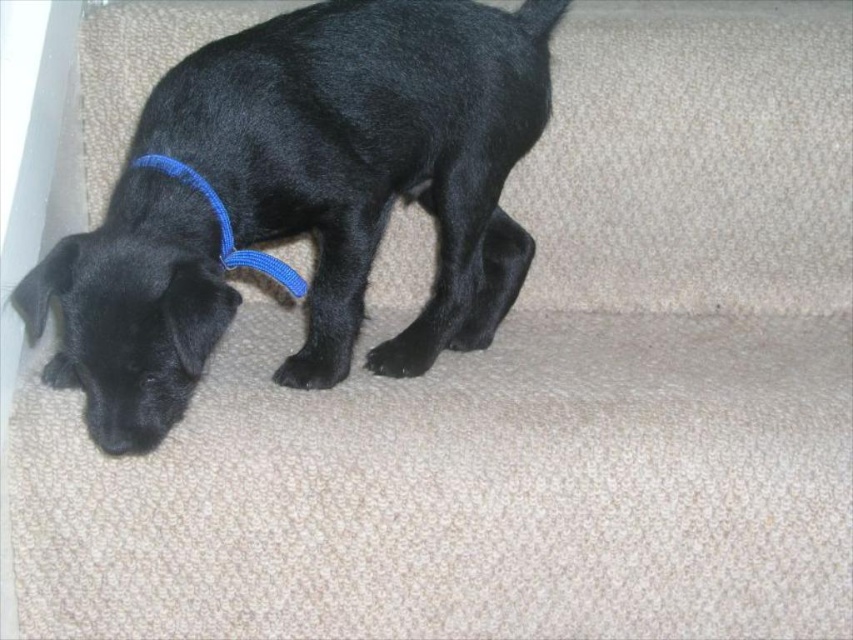
Does black fur dog at lower left appear under blue fabric neckband at left?

Actually, black fur dog at lower left is above blue fabric neckband at left.

Which of these two, black fur dog at lower left or blue fabric neckband at left, stands shorter?

Standing shorter between the two is blue fabric neckband at left.

This screenshot has height=640, width=853. I want to click on black fur dog at lower left, so click(x=302, y=198).